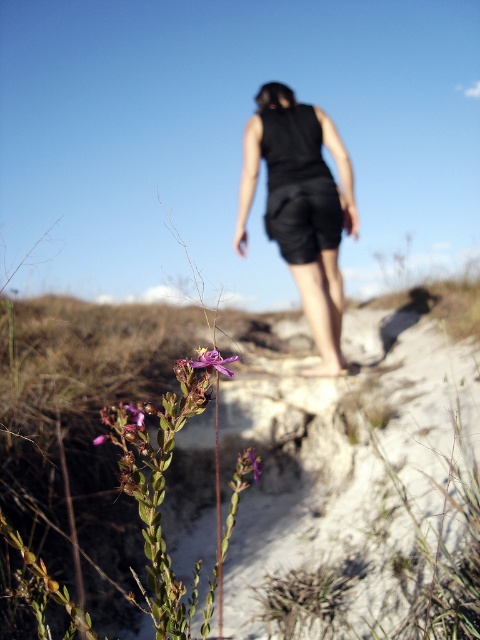
Question: Is purple matte flower at lower left to the right of purple matte flower at center from the viewer's perspective?

Choices:
 (A) no
 (B) yes

Answer: (A)

Question: Is black matte shorts at center above purple matte flower at lower left?

Choices:
 (A) no
 (B) yes

Answer: (B)

Question: Which point is farther to the camera?

Choices:
 (A) (227, 374)
 (B) (295, 268)
 (C) (252, 467)

Answer: (B)

Question: Among these objects, which one is farthest from the camera?

Choices:
 (A) purple matte flower at center
 (B) black matte shorts at center

Answer: (B)

Question: Among these objects, which one is farthest from the camera?

Choices:
 (A) black matte shorts at center
 (B) purple matte flower at lower left
 (C) purple matte flower at center

Answer: (A)

Question: Does black matte shorts at center have a larger size compared to purple matte flower at lower left?

Choices:
 (A) yes
 (B) no

Answer: (A)